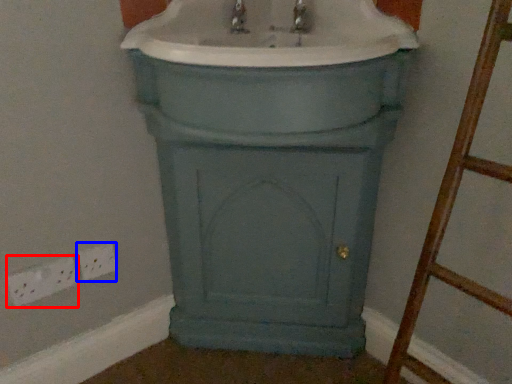
Question: Which object appears farthest to the camera in this image, electric outlet (highlighted by a red box) or electric outlet (highlighted by a blue box)?

Choices:
 (A) electric outlet
 (B) electric outlet

Answer: (B)